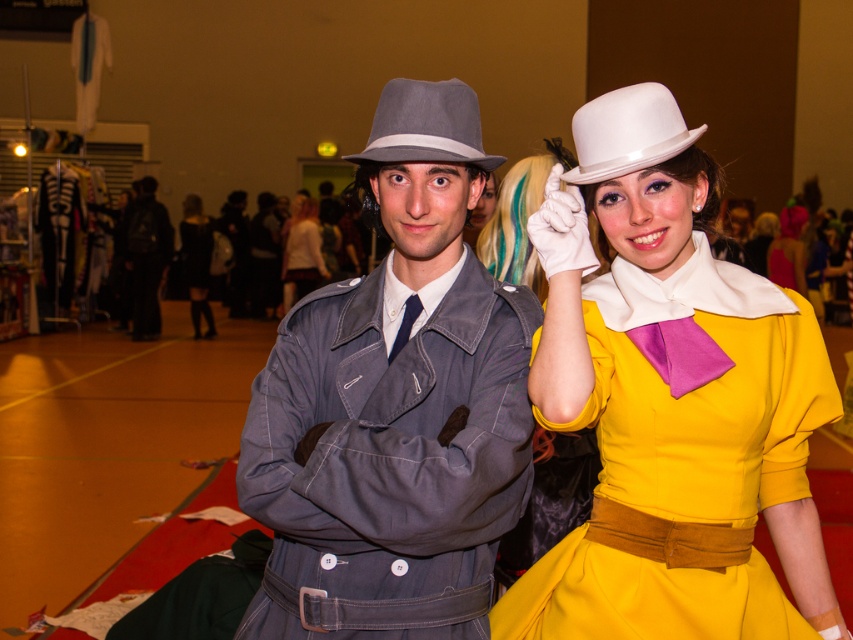
Is matte white hat at upper right taller than matte yellow dress at center?

Incorrect, matte white hat at upper right's height is not larger of matte yellow dress at center's.

Between matte white hat at upper right and matte yellow dress at center, which one is positioned higher?

matte yellow dress at center

Is point (550, 545) closer to viewer compared to point (782, 272)?

Yes, it is in front of point (782, 272).

This screenshot has width=853, height=640. I want to click on matte white hat at upper right, so click(x=550, y=499).

Who is more distant from viewer, (637, 147) or (309, 289)?

The point (309, 289) is behind.

Does white matte dress hat at upper center have a lesser width compared to white satin blouse at center?

Yes, white matte dress hat at upper center is thinner than white satin blouse at center.

Does point (589, 163) lie behind point (287, 268)?

No, (589, 163) is closer to viewer.

Find the location of a particular element. This screenshot has width=853, height=640. white matte dress hat at upper center is located at coordinates pyautogui.click(x=627, y=132).

Who is lower down, matte gray hat at center or white satin blouse at center?

matte gray hat at center

Does matte gray hat at center appear on the right side of white satin blouse at center?

Yes, matte gray hat at center is to the right of white satin blouse at center.

Where is `matte gray hat at center`? The image size is (853, 640). matte gray hat at center is located at coordinates (393, 404).

Find the location of a particular element. Image resolution: width=853 pixels, height=640 pixels. matte gray hat at center is located at coordinates (393, 404).